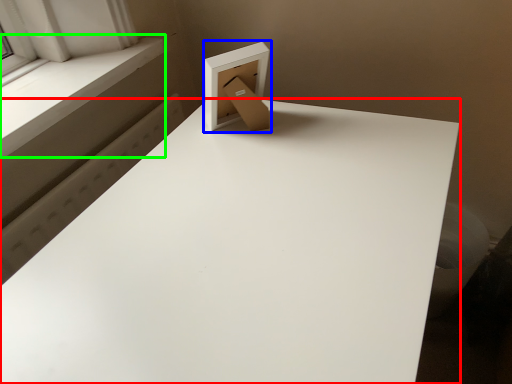
Question: Based on their relative distances, which object is farther from table (highlighted by a red box)? Choose from cardboard box (highlighted by a blue box) and window sill (highlighted by a green box).

Choices:
 (A) cardboard box
 (B) window sill

Answer: (B)